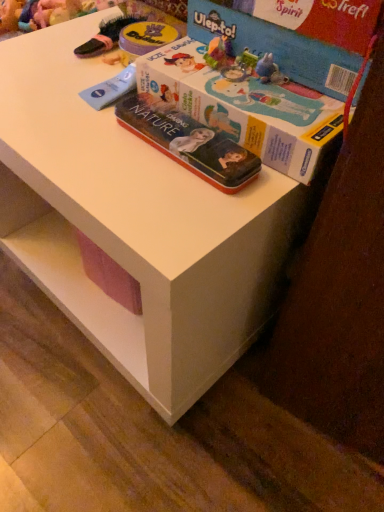
Find the location of a particular element. This screenshot has height=512, width=384. free point to the left of blue cardboard box at upper right, which is counted as the 2th box, starting from the top is located at coordinates (64, 100).